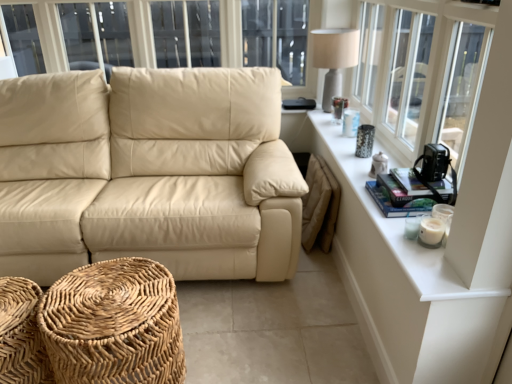
This screenshot has height=384, width=512. Describe the element at coordinates (334, 58) in the screenshot. I see `matte gray table lamp at upper right` at that location.

What is the approximate width of white textured windowsill at upper right?

white textured windowsill at upper right is 9.97 centimeters in width.

Find the location of a particular element. The image size is (512, 384). woven wood footrest at lower left, marked as the second footrest in a right-to-left arrangement is located at coordinates (21, 334).

What is the approximate width of woven wood footrest at lower left, marked as the second footrest in a right-to-left arrangement?

It is 39.56 centimeters.

Image resolution: width=512 pixels, height=384 pixels. I want to click on matte gray table lamp at upper right, so click(x=334, y=58).

Is white ceramic table at upper right not inside matte gray table lamp at upper right?

white ceramic table at upper right is positioned outside matte gray table lamp at upper right.

Is white ceramic table at upper right closer to camera compared to matte gray table lamp at upper right?

Yes, white ceramic table at upper right is closer to the camera.

Is white ceramic table at upper right bigger or smaller than matte gray table lamp at upper right?

white ceramic table at upper right is smaller than matte gray table lamp at upper right.

Could you tell me if white ceramic table at upper right is facing matte gray table lamp at upper right?

No.

From a real-world perspective, is white textured windowsill at upper right beneath beige leather couch at center?

Incorrect, from a real-world perspective, white textured windowsill at upper right is higher than beige leather couch at center.

Is white textured windowsill at upper right outside of beige leather couch at center?

Indeed, white textured windowsill at upper right is completely outside beige leather couch at center.

The width and height of the screenshot is (512, 384). In order to click on studio couch below the white textured windowsill at upper right (from the image's perspective) in this screenshot , I will do `click(158, 178)`.

Considering the relative positions of white textured windowsill at upper right and woven wood footrest at lower left, marked as the second footrest in a right-to-left arrangement, in the image provided, is white textured windowsill at upper right to the left of woven wood footrest at lower left, marked as the second footrest in a right-to-left arrangement, from the viewer's perspective?

Incorrect, white textured windowsill at upper right is not on the left side of woven wood footrest at lower left, marked as the second footrest in a right-to-left arrangement.

Can you confirm if white textured windowsill at upper right is bigger than woven wood footrest at lower left, positioned as the first footrest in left-to-right order?

Yes, white textured windowsill at upper right is bigger than woven wood footrest at lower left, positioned as the first footrest in left-to-right order.

Is white textured windowsill at upper right looking in the opposite direction of woven wood footrest at lower left, marked as the second footrest in a right-to-left arrangement?

No, white textured windowsill at upper right's orientation is not away from woven wood footrest at lower left, marked as the second footrest in a right-to-left arrangement.

Is white textured windowsill at upper right situated inside woven wood footrest at lower left, positioned as the first footrest in left-to-right order, or outside?

white textured windowsill at upper right is outside woven wood footrest at lower left, positioned as the first footrest in left-to-right order.

Considering the relative positions of matte gray table lamp at upper right and woven natural fiber footrest at lower left, the 2th footrest from the left, in the image provided, is matte gray table lamp at upper right in front of woven natural fiber footrest at lower left, the 2th footrest from the left,?

No, matte gray table lamp at upper right is further to the viewer.

In terms of height, does matte gray table lamp at upper right look taller or shorter compared to woven natural fiber footrest at lower left, the 2th footrest from the left?

In the image, matte gray table lamp at upper right appears to be taller than woven natural fiber footrest at lower left, the 2th footrest from the left.

From a real-world perspective, which object rests below the other?

From a 3D spatial view, woven natural fiber footrest at lower left, the 2th footrest from the left, is below.

Considering the positions of point (126, 353) and point (485, 67), is point (126, 353) closer or farther from the camera than point (485, 67)?

Clearly, point (126, 353) is more distant from the camera than point (485, 67).

How distant is woven natural fiber footrest at lower left, the 2th footrest from the left, from white textured windowsill at upper right?

They are 4.43 feet apart.

From the white textured windowsill at upper right, count the 1st footrest to the left and point to it. Please provide its 2D coordinates.

[(114, 324)]

Does woven natural fiber footrest at lower left, the 2th footrest from the left, have a larger size compared to white textured windowsill at upper right?

No.

Which point is more forward, (140, 311) or (19, 296)?

The point (140, 311) is in front.

Which is correct: woven natural fiber footrest at lower left, the 2th footrest from the left, is inside woven wood footrest at lower left, marked as the second footrest in a right-to-left arrangement, or outside of it?

woven natural fiber footrest at lower left, the 2th footrest from the left, is located beyond the bounds of woven wood footrest at lower left, marked as the second footrest in a right-to-left arrangement.

Image resolution: width=512 pixels, height=384 pixels. Identify the location of the footrest that is below the woven natural fiber footrest at lower left, the 2th footrest from the left (from the image's perspective). (21, 334).

Is woven natural fiber footrest at lower left, arranged as the first footrest when viewed from the right, placed right next to woven wood footrest at lower left, positioned as the first footrest in left-to-right order?

woven natural fiber footrest at lower left, arranged as the first footrest when viewed from the right, and woven wood footrest at lower left, positioned as the first footrest in left-to-right order, are clearly separated.

Are beige leather couch at center and woven wood footrest at lower left, marked as the second footrest in a right-to-left arrangement, far apart?

Actually, beige leather couch at center and woven wood footrest at lower left, marked as the second footrest in a right-to-left arrangement, are a little close together.

Looking at this image, is beige leather couch at center bigger or smaller than woven wood footrest at lower left, marked as the second footrest in a right-to-left arrangement?

In the image, beige leather couch at center appears to be larger than woven wood footrest at lower left, marked as the second footrest in a right-to-left arrangement.

Is point (126, 166) closer to viewer compared to point (45, 367)?

No.

Is beige leather couch at center further to camera compared to woven wood footrest at lower left, positioned as the first footrest in left-to-right order?

Yes.

Locate an element on the screen. The width and height of the screenshot is (512, 384). table lamp positioned vertically above the white ceramic table at upper right (from a real-world perspective) is located at coordinates (334, 58).

Locate an element on the screen. The width and height of the screenshot is (512, 384). window above the beige leather couch at center (from the image's perspective) is located at coordinates coord(422,71).

Which object lies nearer to the anchor point beige leather couch at center, white textured windowsill at upper right or woven wood footrest at lower left, marked as the second footrest in a right-to-left arrangement?

Among the two, woven wood footrest at lower left, marked as the second footrest in a right-to-left arrangement, is located nearer to beige leather couch at center.

Looking at the image, which one is located closer to beige leather couch at center, woven natural fiber footrest at lower left, arranged as the first footrest when viewed from the right, or white textured windowsill at upper right?

Based on the image, woven natural fiber footrest at lower left, arranged as the first footrest when viewed from the right, appears to be nearer to beige leather couch at center.

From the image, which object appears to be farther from white textured windowsill at upper right, woven natural fiber footrest at lower left, the 2th footrest from the left, or matte gray table lamp at upper right?

Among the two, woven natural fiber footrest at lower left, the 2th footrest from the left, is located further to white textured windowsill at upper right.

Estimate the real-world distances between objects in this image. Which object is further from matte gray table lamp at upper right, woven wood footrest at lower left, positioned as the first footrest in left-to-right order, or beige leather couch at center?

Based on the image, woven wood footrest at lower left, positioned as the first footrest in left-to-right order, appears to be further to matte gray table lamp at upper right.

Considering their positions, is matte gray table lamp at upper right positioned further to white ceramic table at upper right than woven wood footrest at lower left, marked as the second footrest in a right-to-left arrangement?

Based on the image, woven wood footrest at lower left, marked as the second footrest in a right-to-left arrangement, appears to be further to white ceramic table at upper right.

Based on their spatial positions, is white textured windowsill at upper right or woven natural fiber footrest at lower left, the 2th footrest from the left, further from white ceramic table at upper right?

woven natural fiber footrest at lower left, the 2th footrest from the left, is positioned further to the anchor white ceramic table at upper right.

When comparing their distances from woven natural fiber footrest at lower left, arranged as the first footrest when viewed from the right, does matte gray table lamp at upper right or beige leather couch at center seem further?

matte gray table lamp at upper right is further to woven natural fiber footrest at lower left, arranged as the first footrest when viewed from the right.

When comparing their distances from woven natural fiber footrest at lower left, arranged as the first footrest when viewed from the right, does white textured windowsill at upper right or matte gray table lamp at upper right seem closer?

The object closer to woven natural fiber footrest at lower left, arranged as the first footrest when viewed from the right, is white textured windowsill at upper right.

Find the location of a particular element. the footrest located between woven wood footrest at lower left, marked as the second footrest in a right-to-left arrangement, and white ceramic table at upper right in the left-right direction is located at coordinates (114, 324).

The width and height of the screenshot is (512, 384). What are the coordinates of `footrest between matte gray table lamp at upper right and woven wood footrest at lower left, positioned as the first footrest in left-to-right order, from top to bottom` in the screenshot? It's located at (114, 324).

Locate an element on the screen. The image size is (512, 384). table lamp between beige leather couch at center and white ceramic table at upper right in the horizontal direction is located at coordinates (334, 58).

Image resolution: width=512 pixels, height=384 pixels. Find the location of `the footrest located between beige leather couch at center and white ceramic table at upper right in the left-right direction`. the footrest located between beige leather couch at center and white ceramic table at upper right in the left-right direction is located at coordinates (114, 324).